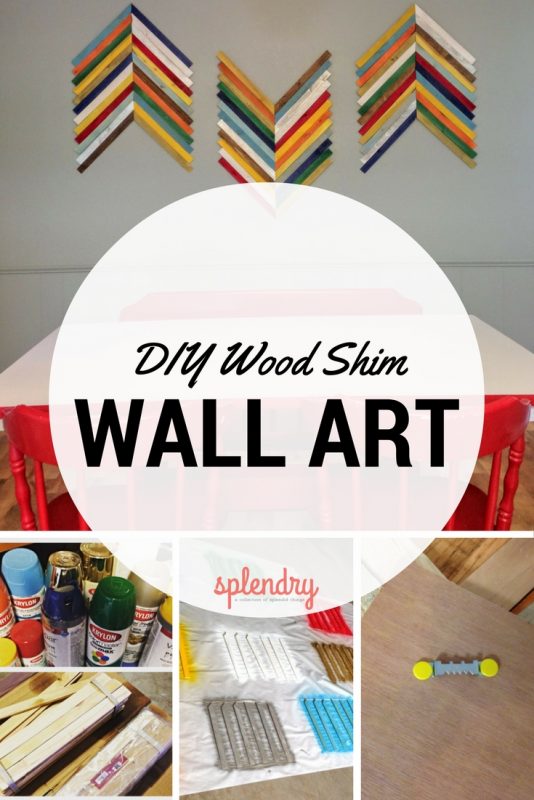
The image size is (534, 800). I want to click on wall art text, so click(214, 441).